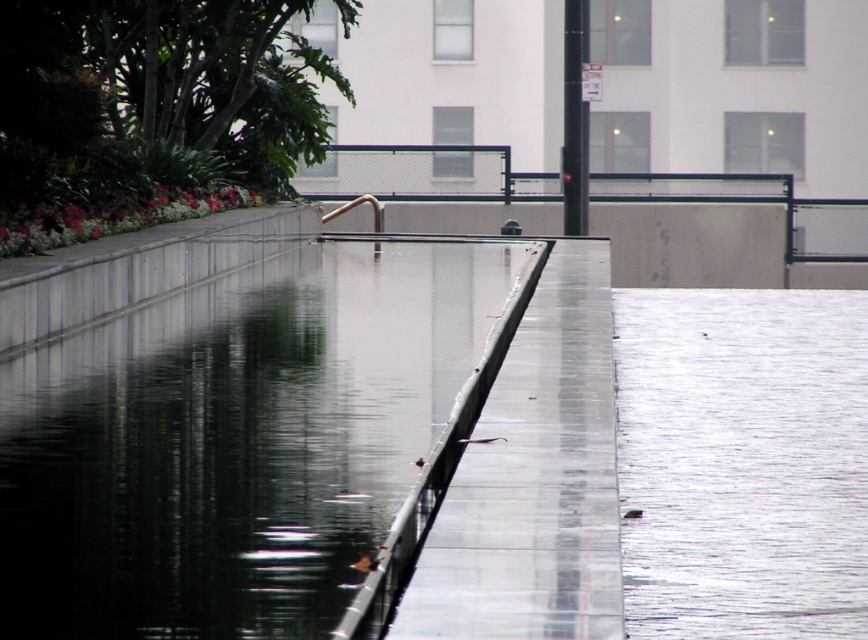
In the scene shown: You are standing at the edge of the reflecting pool and want to walk to the glossy concrete pavement at lower right without stepping into the transparent glass water at center. Is there a clear path available?

The transparent glass water at center is closer to the viewer than the glossy concrete pavement at lower right, so you can walk around it to reach the glossy concrete pavement at lower right without stepping into the water.

Consider the image. You are a delivery robot with a width of 1.5 meters. You need to move from the transparent glass water at center to the glossy concrete pavement at lower right. Can you pass through the space between them without any obstacles?

The transparent glass water at center and glossy concrete pavement at lower right are 1.56 meters apart from each other. Since your width is 1.5 meters, you can pass through the space between them without any issues.

You are standing at the edge of the pool and want to place a small decorative stone on the glossy concrete pavement at lower right. The stone is 10 cm in diameter. Can the transparent glass water at center accommodate the stone if you drop it in?

The transparent glass water at center has a smaller size compared to glossy concrete pavement at lower right. Since the stone is 10 cm in diameter, it would likely fit into the transparent glass water at center as long as the water depth is sufficient. However, the question is about accommodating the stone when dropped, which depends on the water depth and the size of the water area. Since the water area is smaller than the pavement, but the stone is small, it might fit, but the exact answer requires more.